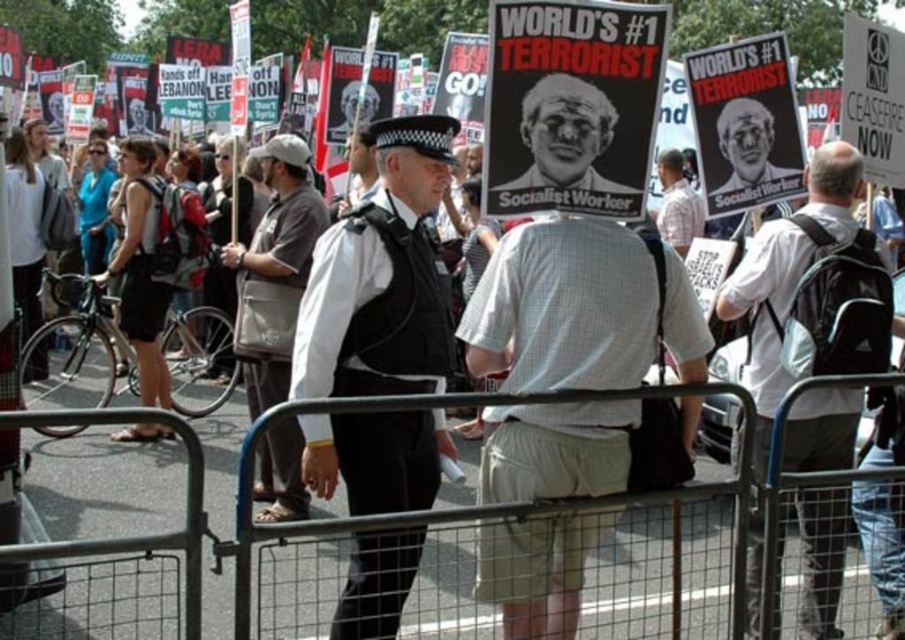
Question: Based on their relative distances, which object is nearer to the black uniformed officer at center?

Choices:
 (A) black matte poster at center
 (B) khaki canvas bag at center
 (C) plaid shirt at center

Answer: (A)

Question: Is black uniformed officer at center bigger than plaid shirt at center?

Choices:
 (A) no
 (B) yes

Answer: (B)

Question: Is white shirt at center thinner than black matte poster at center?

Choices:
 (A) yes
 (B) no

Answer: (A)

Question: Considering the real-world distances, which object is closest to the black uniformed officer at center?

Choices:
 (A) plaid shirt at center
 (B) white checkered shirt at center

Answer: (B)

Question: Can you confirm if black uniformed officer at center is wider than white shirt at center?

Choices:
 (A) yes
 (B) no

Answer: (A)

Question: Which object appears closest to the camera in this image?

Choices:
 (A) black matte poster at center
 (B) white checkered shirt at center
 (C) plaid shirt at center

Answer: (B)